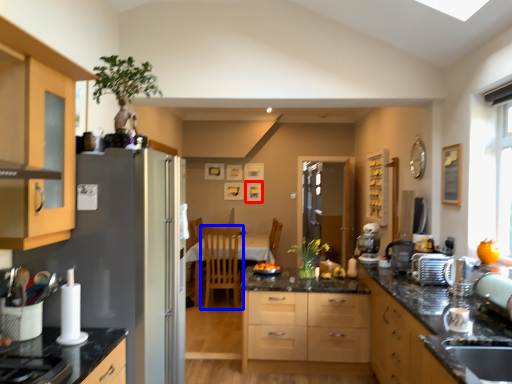
Question: Which point is closer to the camera, picture frame (highlighted by a red box) or chair (highlighted by a blue box)?

Choices:
 (A) picture frame
 (B) chair

Answer: (B)